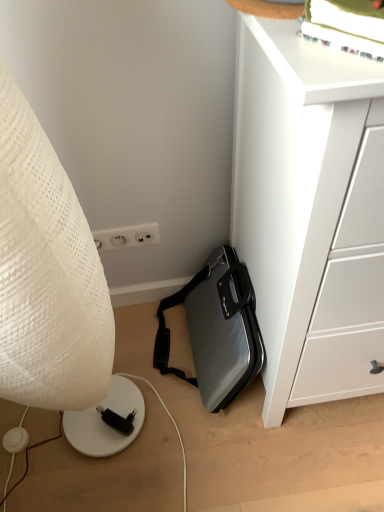
Question: From the image's perspective, is silver textured briefcase at lower center located above or below white textured lamp at left?

Choices:
 (A) below
 (B) above

Answer: (A)

Question: Visually, is silver textured briefcase at lower center positioned to the left or to the right of white textured lamp at left?

Choices:
 (A) right
 (B) left

Answer: (A)

Question: Considering the real-world distances, which object is farthest from the white textured lamp at left?

Choices:
 (A) silver textured briefcase at lower center
 (B) white matte chest of drawers at lower right

Answer: (A)

Question: Which is farther from the silver textured briefcase at lower center?

Choices:
 (A) white matte chest of drawers at lower right
 (B) white textured lamp at left

Answer: (B)